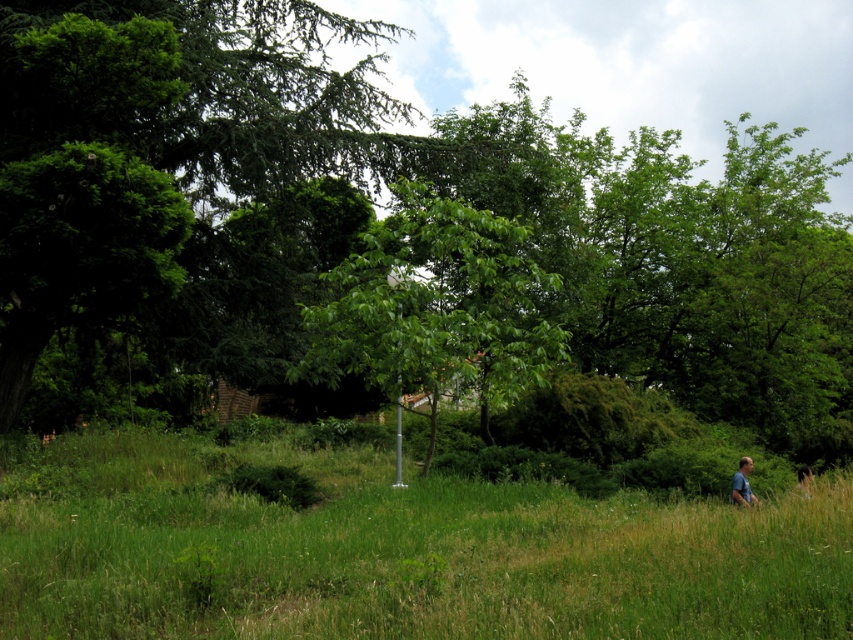
Question: Can you confirm if green leafy tree at center is positioned to the right of blue cotton shirt at lower right?

Choices:
 (A) yes
 (B) no

Answer: (B)

Question: In this image, where is green grass at lower right located relative to green leafy tree at center?

Choices:
 (A) above
 (B) below

Answer: (B)

Question: Which point is farther to the camera?

Choices:
 (A) blue cotton shirt at lower right
 (B) green grass at lower right

Answer: (A)

Question: Which of the following is the closest to the observer?

Choices:
 (A) green leafy tree at center
 (B) green grass at lower right

Answer: (B)

Question: Is green grass at lower right positioned behind green leafy tree at center?

Choices:
 (A) no
 (B) yes

Answer: (A)

Question: Which point appears farthest from the camera in this image?

Choices:
 (A) (817, 595)
 (B) (740, 474)

Answer: (B)